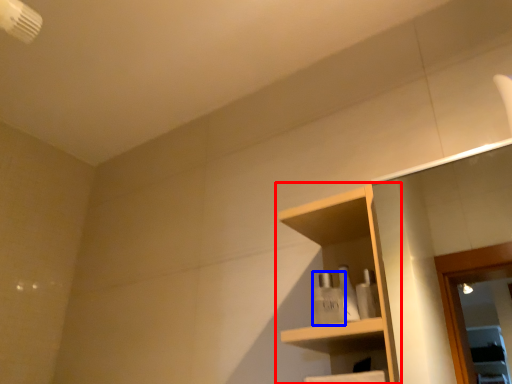
Question: Which point is closer to the camera, shelf (highlighted by a red box) or toiletry (highlighted by a blue box)?

Choices:
 (A) shelf
 (B) toiletry

Answer: (A)